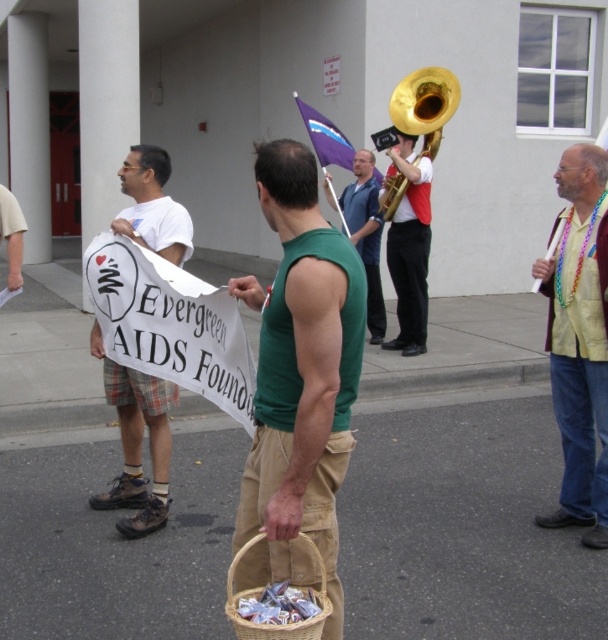
Based on the photo, does multicolored beaded necklace at right have a lesser height compared to khaki shorts at lower left?

In fact, multicolored beaded necklace at right may be taller than khaki shorts at lower left.

Is multicolored beaded necklace at right bigger than khaki shorts at lower left?

Indeed, multicolored beaded necklace at right has a larger size compared to khaki shorts at lower left.

Who is more distant from viewer, (568, 480) or (7, 284)?

The point (7, 284) is behind.

The image size is (608, 640). Find the location of `multicolored beaded necklace at right`. multicolored beaded necklace at right is located at coordinates (579, 340).

Does white cotton t-shirt at left have a lesser width compared to gold shiny tuba at upper right?

Correct, white cotton t-shirt at left's width is less than gold shiny tuba at upper right's.

Can you confirm if white cotton t-shirt at left is positioned above gold shiny tuba at upper right?

Incorrect, white cotton t-shirt at left is not positioned above gold shiny tuba at upper right.

Who is more forward, (159, 497) or (416, 131)?

Point (159, 497) is more forward.

At what (x,y) coordinates should I click in order to perform the action: click on white cotton t-shirt at left. Please return your answer as a coordinate pair (x, y). The height and width of the screenshot is (640, 608). Looking at the image, I should click on (136, 442).

Which of these two, blue denim shirt at center or woven brown basket at lower center, stands taller?

blue denim shirt at center is taller.

Does blue denim shirt at center have a smaller size compared to woven brown basket at lower center?

No.

Between point (350, 237) and point (322, 588), which one is positioned in front?

Point (322, 588) is in front.

The height and width of the screenshot is (640, 608). I want to click on blue denim shirt at center, so click(367, 236).